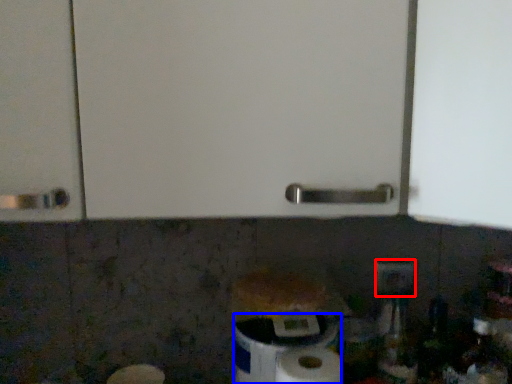
Question: Which point is further to the camera, electric outlet (highlighted by a red box) or toilet paper (highlighted by a blue box)?

Choices:
 (A) electric outlet
 (B) toilet paper

Answer: (A)